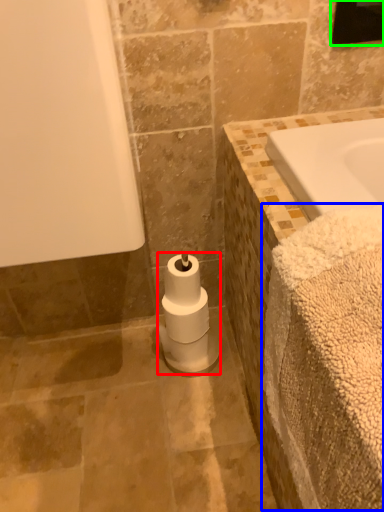
Question: Estimate the real-world distances between objects in this image. Which object is farther from toilet paper (highlighted by a red box), bath towel (highlighted by a blue box) or mirror (highlighted by a green box)?

Choices:
 (A) bath towel
 (B) mirror

Answer: (B)